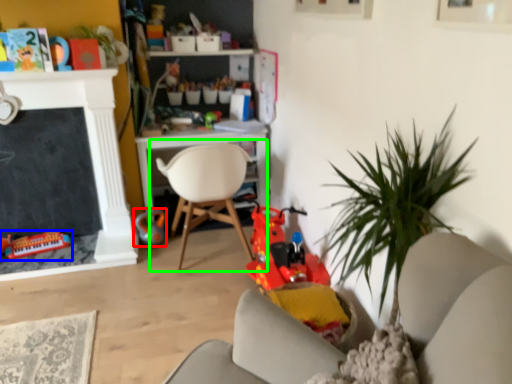
Question: Which object is positioned farthest from toy (highlighted by a red box)? Select from toy (highlighted by a blue box) and chair (highlighted by a green box).

Choices:
 (A) toy
 (B) chair

Answer: (A)